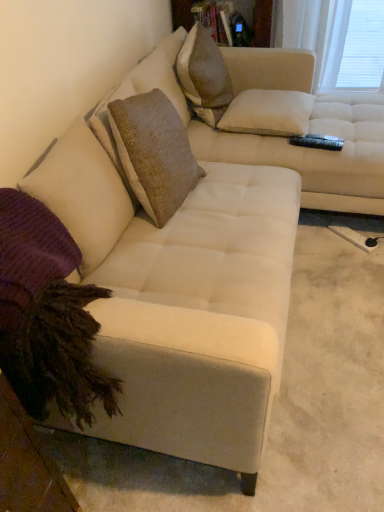
Question: Should I look upward or downward to see textured beige pillow at upper center?

Choices:
 (A) up
 (B) down

Answer: (A)

Question: Is white matte window screen at upper right inside white textured pillow at upper center, the second pillow viewed from the left?

Choices:
 (A) no
 (B) yes

Answer: (A)

Question: Is white textured pillow at upper center, the second pillow viewed from the left, positioned with its back to white matte window screen at upper right?

Choices:
 (A) no
 (B) yes

Answer: (A)

Question: From the image's perspective, would you say white textured pillow at upper center, the second pillow viewed from the left, is positioned over white matte window screen at upper right?

Choices:
 (A) no
 (B) yes

Answer: (A)

Question: From a real-world perspective, does white textured pillow at upper center, the second pillow viewed from the left, sit lower than white matte window screen at upper right?

Choices:
 (A) yes
 (B) no

Answer: (B)

Question: Considering the relative sizes of white textured pillow at upper center, the second pillow in the bottom-to-top sequence, and white matte window screen at upper right in the image provided, is white textured pillow at upper center, the second pillow in the bottom-to-top sequence, smaller than white matte window screen at upper right?

Choices:
 (A) yes
 (B) no

Answer: (A)

Question: Is white textured pillow at upper center, placed as the first pillow when sorted from right to left, closer to camera compared to white matte window screen at upper right?

Choices:
 (A) yes
 (B) no

Answer: (A)

Question: From the image's perspective, is white matte window screen at upper right on top of textured beige pillow at upper center?

Choices:
 (A) yes
 (B) no

Answer: (A)

Question: From the image's perspective, is white matte window screen at upper right located beneath textured beige pillow at upper center?

Choices:
 (A) no
 (B) yes

Answer: (A)

Question: Considering the relative sizes of white matte window screen at upper right and textured beige pillow at upper center in the image provided, is white matte window screen at upper right smaller than textured beige pillow at upper center?

Choices:
 (A) no
 (B) yes

Answer: (B)

Question: Can textured beige pillow at upper center be found inside white matte window screen at upper right?

Choices:
 (A) yes
 (B) no

Answer: (B)

Question: Does white matte window screen at upper right have a lesser width compared to textured beige pillow at upper center?

Choices:
 (A) no
 (B) yes

Answer: (B)

Question: Can you confirm if white matte window screen at upper right is wider than textured beige pillow at upper center?

Choices:
 (A) no
 (B) yes

Answer: (A)

Question: Can you see purple knitted pillow at lower left, marked as the first pillow in a left-to-right arrangement, touching white matte window screen at upper right?

Choices:
 (A) yes
 (B) no

Answer: (B)